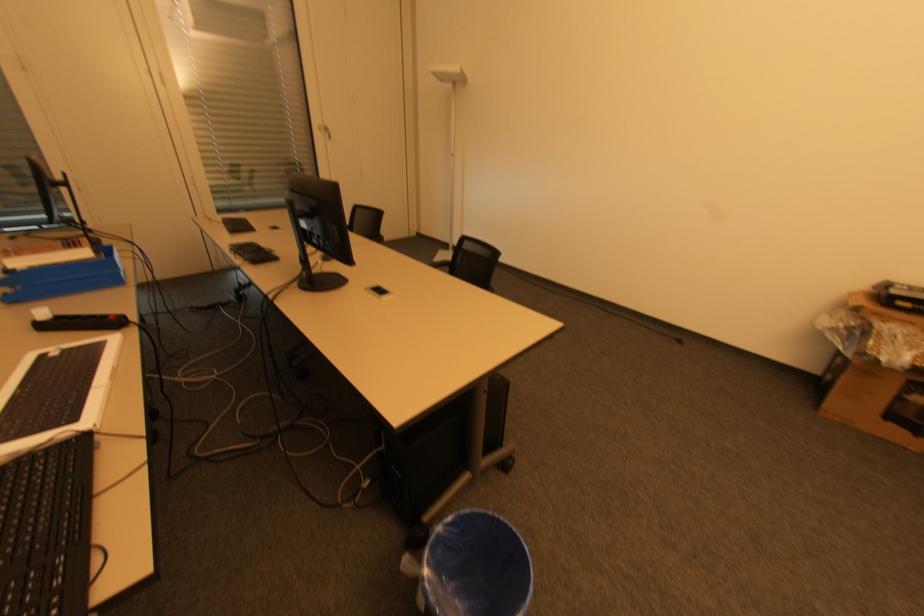
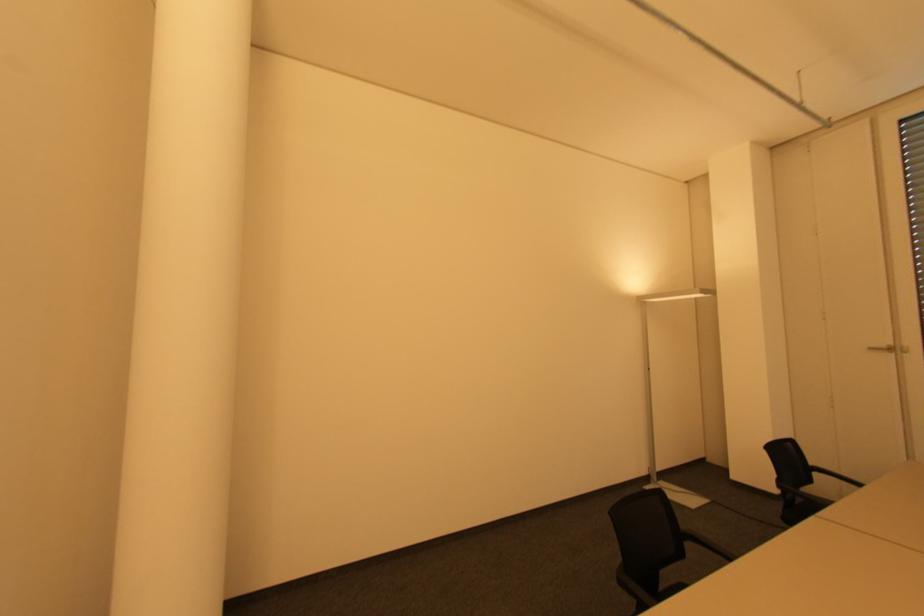
Question: The images are taken continuously from a first-person perspective. In which direction is your viewpoint rotating?

Choices:
 (A) Left
 (B) Right
 (C) Up
 (D) Down

Answer: (A)